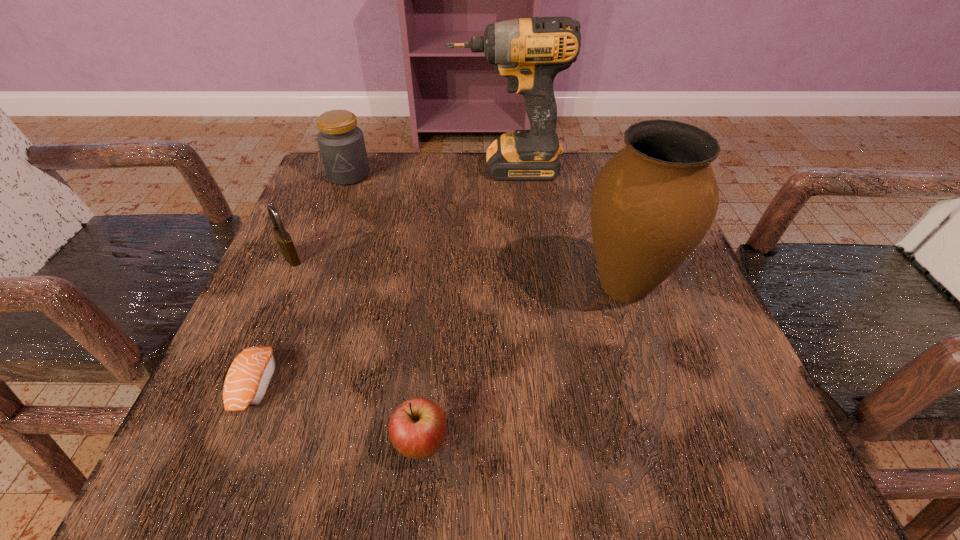
Select which object is the third closest to the apple. Please provide its 2D coordinates. Your answer should be formatted as a tuple, i.e. [(x, y)], where the tuple contains the x and y coordinates of a point satisfying the conditions above.

[(284, 240)]

Select which object appears as the third closest to the padlock. Please provide its 2D coordinates. Your answer should be formatted as a tuple, i.e. [(x, y)], where the tuple contains the x and y coordinates of a point satisfying the conditions above.

[(529, 52)]

The width and height of the screenshot is (960, 540). Find the location of `vacant space that satisfies the following two spatial constraints: 1. on the back side of the urn; 2. with the drill bit of the drill facing forward`. vacant space that satisfies the following two spatial constraints: 1. on the back side of the urn; 2. with the drill bit of the drill facing forward is located at coordinates 587,168.

At what (x,y) coordinates should I click in order to perform the action: click on free space that satisfies the following two spatial constraints: 1. on the surface of the fifth tallest object near the warning symbol; 2. on the left side of the third tallest object. Please return your answer as a coordinate pair (x, y). Looking at the image, I should click on (246, 444).

This screenshot has height=540, width=960. I want to click on vacant area in the image that satisfies the following two spatial constraints: 1. on the surface of the fourth shortest object near the warning symbol; 2. on the left side of the apple, so click(246, 444).